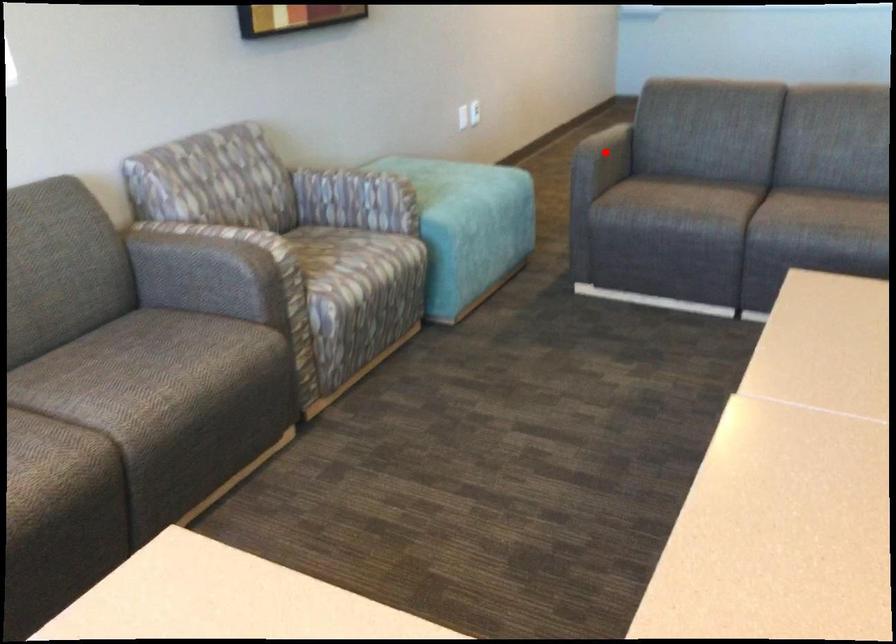
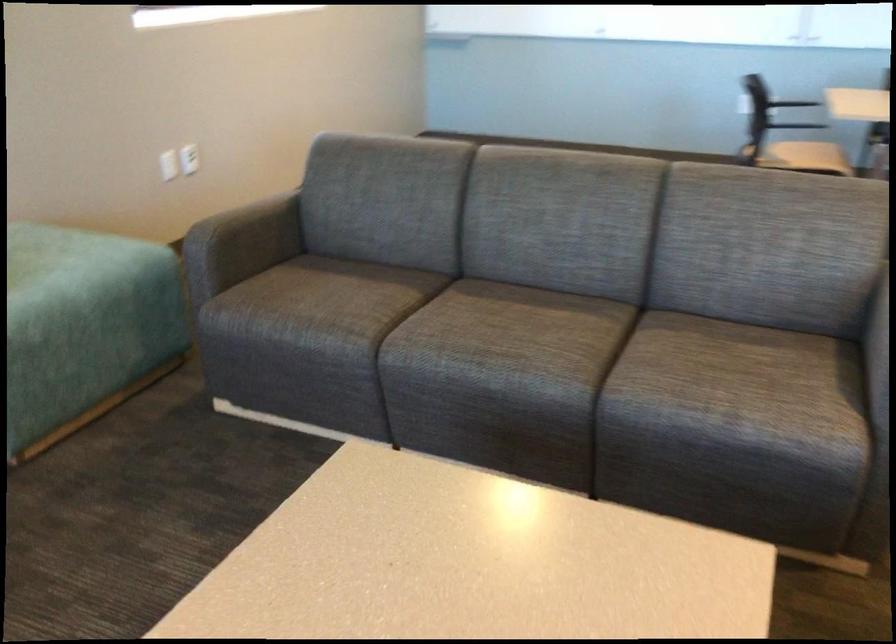
Question: I am providing you with two images of the same scene from different viewpoints. A red point is shown in image1. For the corresponding object point in image2, is it positioned nearer or farther from the camera?

Choices:
 (A) Nearer
 (B) Farther

Answer: (A)